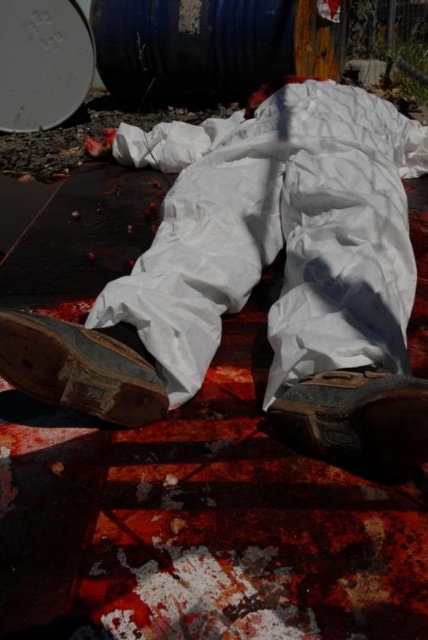
Question: Which point appears closest to the camera in this image?

Choices:
 (A) (296, 448)
 (B) (50, 349)

Answer: (B)

Question: Does white matte suit at center appear under brown suede shoe at lower center?

Choices:
 (A) yes
 (B) no

Answer: (B)

Question: Which object appears closest to the camera in this image?

Choices:
 (A) white matte suit at center
 (B) brown suede shoe at lower center
 (C) brown leather shoe at lower left

Answer: (B)

Question: Where is blue metallic barrel at upper center located in relation to brown leather shoe at lower left in the image?

Choices:
 (A) left
 (B) right

Answer: (B)

Question: Is blue metallic barrel at upper center positioned before brown suede shoe at lower center?

Choices:
 (A) yes
 (B) no

Answer: (B)

Question: Which point is farther to the camera?

Choices:
 (A) brown leather shoe at lower left
 (B) white matte suit at center
 (C) brown suede shoe at lower center
 (D) blue metallic barrel at upper center

Answer: (D)